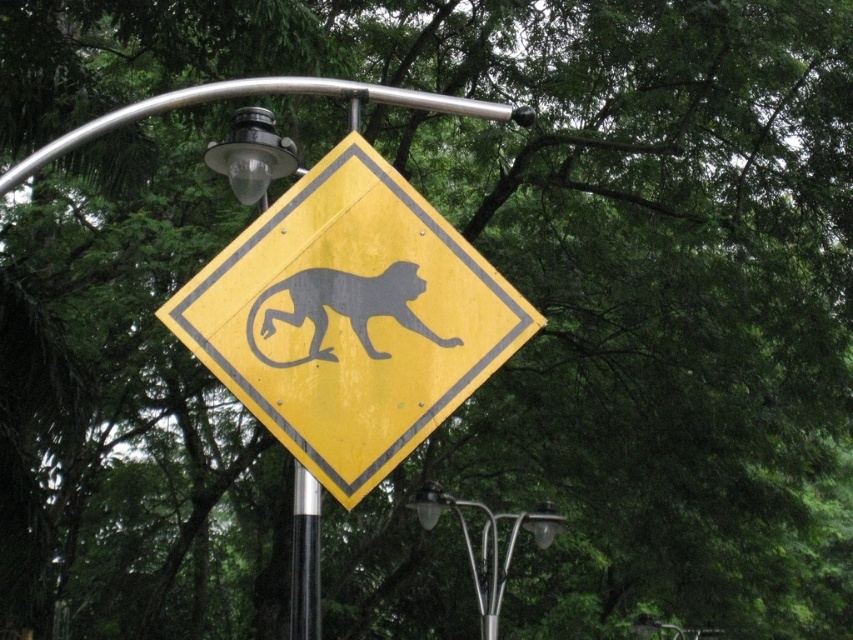
You are a hiker in a forest area and see a yellow diamond road sign with a panther silhouette. There is a point at coordinates [350,317]. Where is the yellow reflective diamond located relative to this point?

The yellow reflective diamond is located exactly at the point [350,317], as stated in the description.

From the picture: You are a hiker who wants to take a photo of the yellow reflective diamond at center and the metallic silver streetlight at lower center. To ensure both are visible in the frame, which object should you focus on first?

The yellow reflective diamond at center is much taller than the metallic silver streetlight at lower center, so you should focus on the yellow reflective diamond at center first to ensure it fits in the frame.